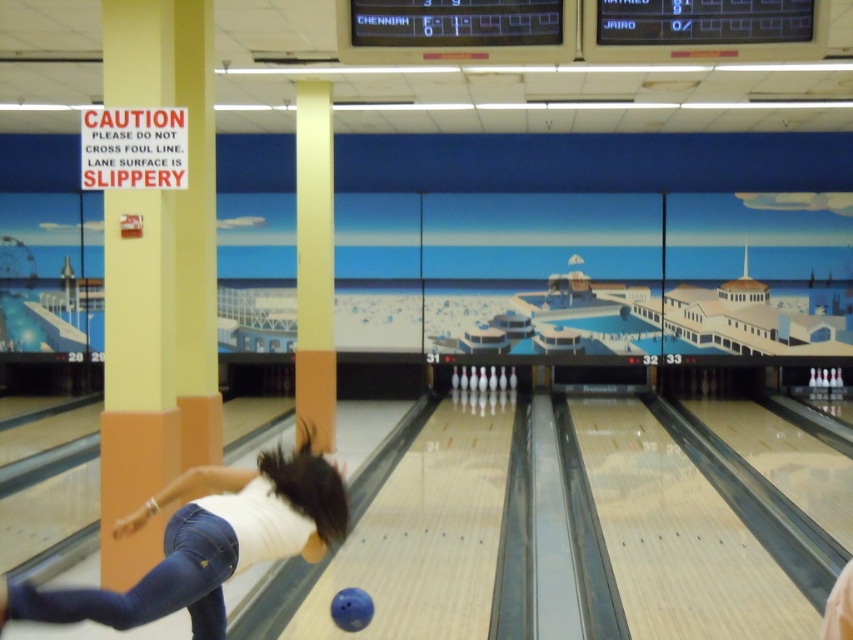
Question: Which point is farther to the camera?

Choices:
 (A) (74, 611)
 (B) (187, 541)

Answer: (B)

Question: Which point is farther to the camera?

Choices:
 (A) (x=347, y=602)
 (B) (x=279, y=500)
 (C) (x=225, y=536)

Answer: (A)

Question: Can you confirm if denim at left is wider than blue rubber bowling ball at center?

Choices:
 (A) no
 (B) yes

Answer: (B)

Question: Considering the relative positions of white matte shirt at center and denim at left in the image provided, where is white matte shirt at center located with respect to denim at left?

Choices:
 (A) right
 (B) left

Answer: (A)

Question: Is denim at left positioned at the back of blue rubber bowling ball at center?

Choices:
 (A) yes
 (B) no

Answer: (B)

Question: Estimate the real-world distances between objects in this image. Which object is closer to the blue rubber bowling ball at center?

Choices:
 (A) white matte shirt at center
 (B) denim at left

Answer: (A)